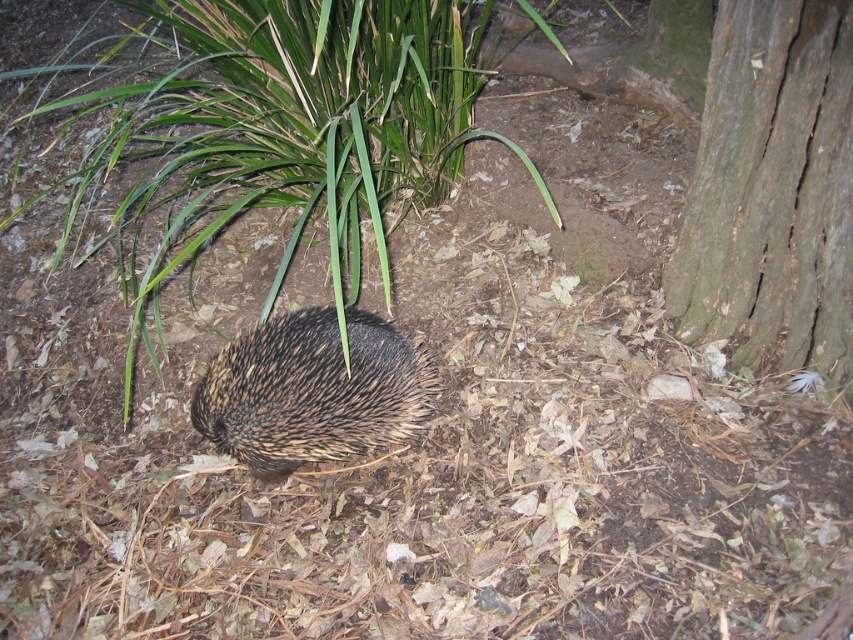
You are a small animal trying to hide from a predator. You see the green leafy grass at center and the dark brown rough bark at right. Which would provide better cover based on their height?

The green leafy grass at center is taller than the dark brown rough bark at right, so it would provide better cover for hiding.

From the picture: You are an ecologist studying the echidna in the image. The echidna is currently facing north. If you want to place a food source directly to the north of the green leafy grass at center, where should you place it relative to the echidna?

The green leafy grass at center is located at point (283, 132). To place the food source directly north of it, you would position it north of the green leafy grass at center, which would be north of the echidna since the echidna is facing north.